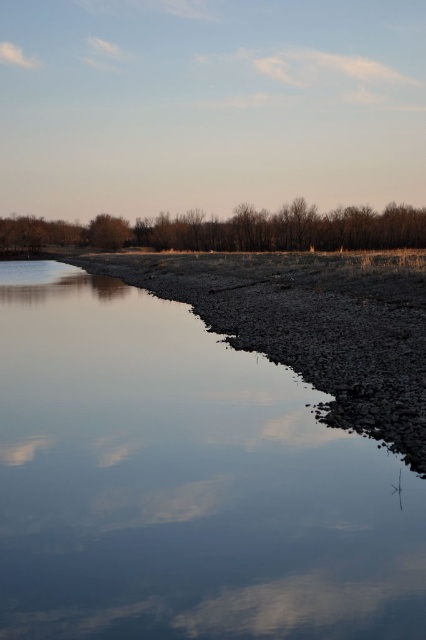
Question: Can you confirm if smooth reflective water at center is positioned above brown textured trees at upper center?

Choices:
 (A) yes
 (B) no

Answer: (B)

Question: Can you confirm if smooth reflective water at center is thinner than brown textured trees at upper center?

Choices:
 (A) no
 (B) yes

Answer: (B)

Question: Can you confirm if smooth reflective water at center is bigger than brown textured trees at upper center?

Choices:
 (A) yes
 (B) no

Answer: (B)

Question: Which object is closer to the camera taking this photo?

Choices:
 (A) brown textured trees at upper center
 (B) smooth reflective water at center

Answer: (B)

Question: Which of the following is the farthest from the observer?

Choices:
 (A) (276, 237)
 (B) (213, 557)

Answer: (A)